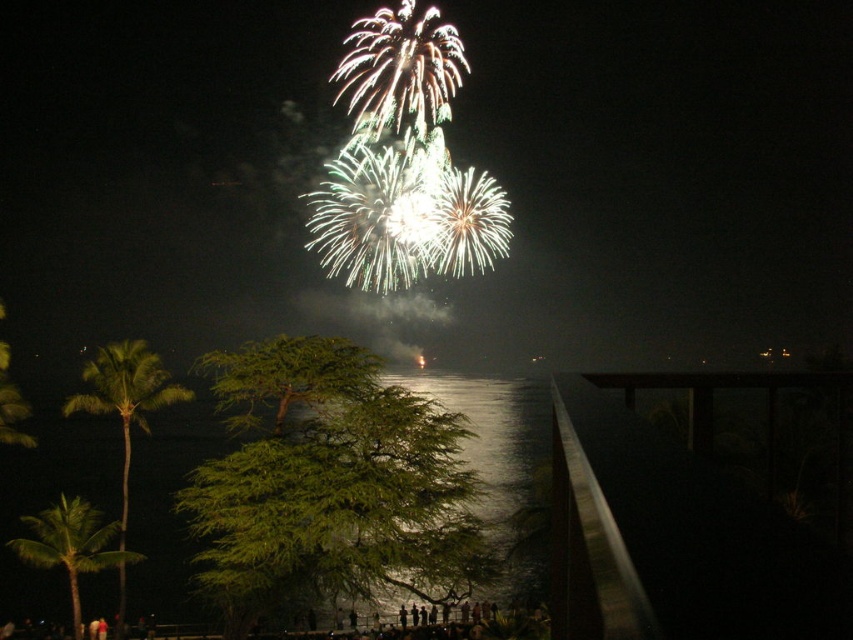
Who is positioned more to the left, glistening metallic water at center or green leafy palm tree at left?

green leafy palm tree at left is more to the left.

Does glistening metallic water at center have a lesser width compared to green leafy palm tree at left?

Yes.

Is point (479, 426) behind point (109, 410)?

Yes, point (479, 426) is farther from viewer.

Locate an element on the screen. The image size is (853, 640). glistening metallic water at center is located at coordinates (491, 483).

Between point (521, 545) and point (85, 540), which one is positioned in front?

Positioned in front is point (85, 540).

Measure the distance between glistening metallic water at center and camera.

A distance of 22.14 meters exists between glistening metallic water at center and camera.

The width and height of the screenshot is (853, 640). I want to click on glistening metallic water at center, so click(x=491, y=483).

Can you confirm if green leafy palm tree at left is thinner than green leafy palm tree at lower left?

No, green leafy palm tree at left is not thinner than green leafy palm tree at lower left.

The width and height of the screenshot is (853, 640). Find the location of `green leafy palm tree at left`. green leafy palm tree at left is located at coordinates (125, 397).